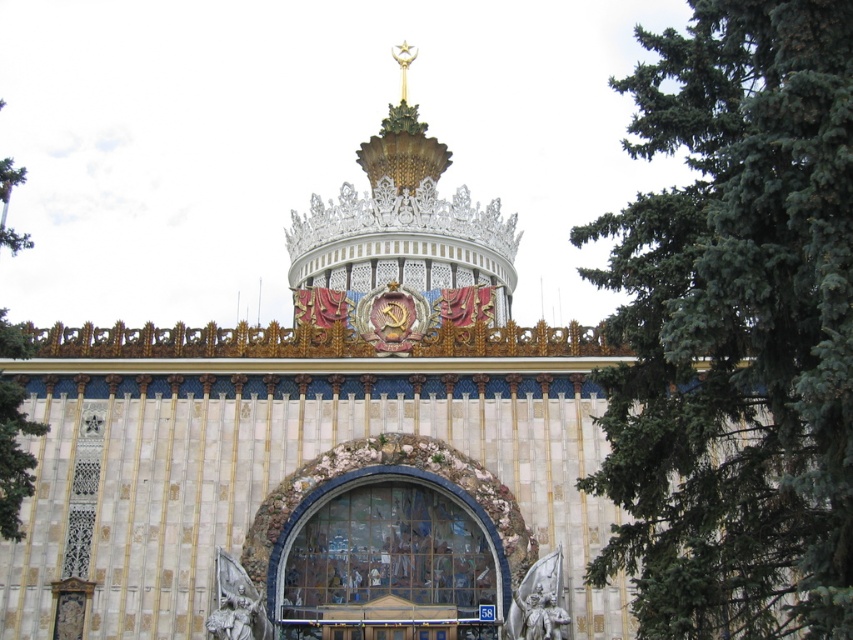
Question: Considering the relative positions of green needle-like leaves at upper right and green leafy tree at left in the image provided, where is green needle-like leaves at upper right located with respect to green leafy tree at left?

Choices:
 (A) above
 (B) below

Answer: (B)

Question: Which of the following is the farthest from the observer?

Choices:
 (A) (624, 499)
 (B) (445, 529)
 (C) (16, 422)

Answer: (B)

Question: Which object is closer to the camera taking this photo?

Choices:
 (A) translucent glass mosaic at center
 (B) green leafy tree at left
 (C) green needle-like leaves at upper right

Answer: (C)

Question: Is translucent glass mosaic at center to the right of green leafy tree at left from the viewer's perspective?

Choices:
 (A) no
 (B) yes

Answer: (B)

Question: Can you confirm if translucent glass mosaic at center is bigger than green leafy tree at left?

Choices:
 (A) yes
 (B) no

Answer: (B)

Question: Which of the following is the farthest from the observer?

Choices:
 (A) (697, 243)
 (B) (24, 170)
 (C) (293, 596)

Answer: (B)